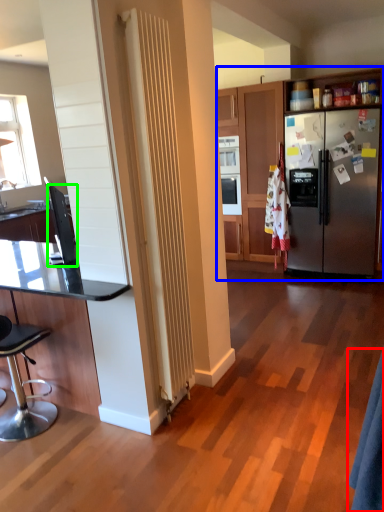
Question: Based on their relative distances, which object is farther from robe (highlighted by a red box)? Choose from cabinetry (highlighted by a blue box) and appliance (highlighted by a green box).

Choices:
 (A) cabinetry
 (B) appliance

Answer: (A)